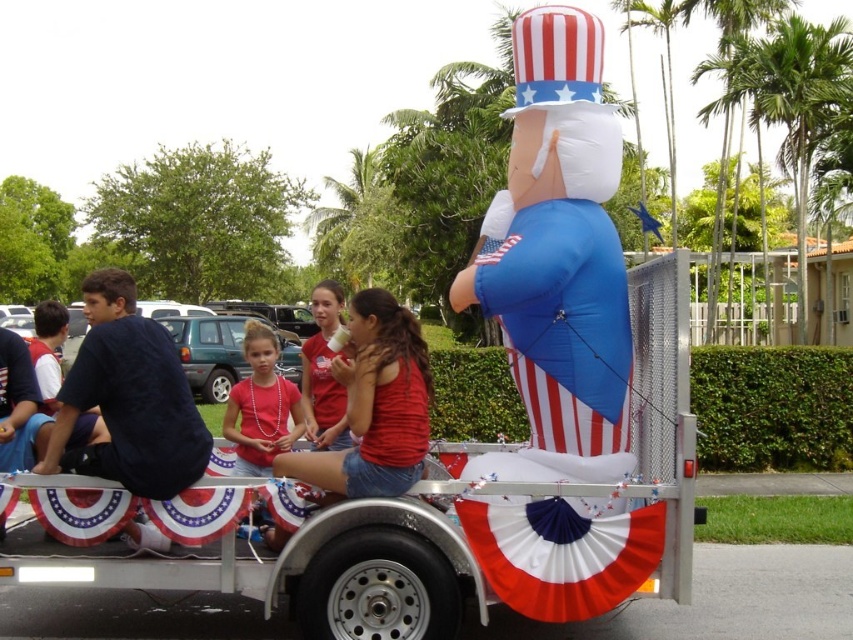
Question: Which object is farther from the camera taking this photo?

Choices:
 (A) inflatable uncle sam at center
 (B) red white and blue fabric at center
 (C) matte red shirt at center
 (D) dark blue fabric shirt at left

Answer: (C)

Question: Does inflatable uncle sam at center have a lesser width compared to red white and blue fabric at center?

Choices:
 (A) no
 (B) yes

Answer: (A)

Question: Which point is farther to the camera?

Choices:
 (A) (114, 348)
 (B) (296, 420)

Answer: (B)

Question: From the image, what is the correct spatial relationship of inflatable uncle sam at center in relation to matte red shirt at center?

Choices:
 (A) left
 (B) right

Answer: (B)

Question: Which object is closer to the camera taking this photo?

Choices:
 (A) inflatable uncle sam at center
 (B) matte red shirt at center
 (C) dark blue fabric shirt at left

Answer: (A)

Question: Can you confirm if inflatable uncle sam at center is wider than matte red shirt at center?

Choices:
 (A) no
 (B) yes

Answer: (B)